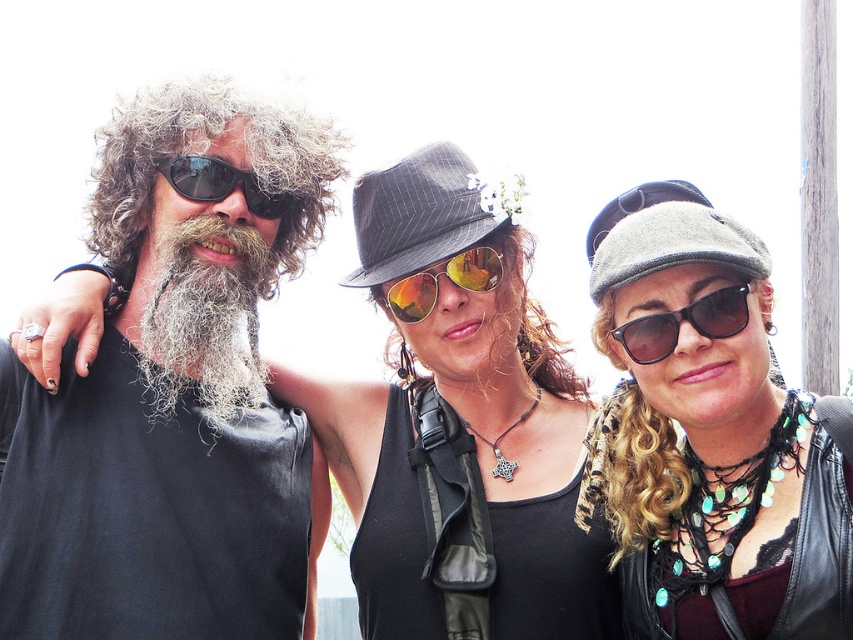
Question: Where is matte black tank top at left located in relation to leather jacket at center in the image?

Choices:
 (A) left
 (B) right

Answer: (A)

Question: Estimate the real-world distances between objects in this image. Which object is closer to the matte black tank top at left?

Choices:
 (A) reflective gold sunglasses at center
 (B) black pinstripe fedora at center
 (C) gray fabric cap at center
 (D) black reflective sunglasses at left

Answer: (D)

Question: Can you confirm if white curly beard at left is thinner than gray felt cap at center?

Choices:
 (A) yes
 (B) no

Answer: (B)

Question: Can you confirm if black reflective sunglasses at left is thinner than gray felt cap at center?

Choices:
 (A) no
 (B) yes

Answer: (A)

Question: Estimate the real-world distances between objects in this image. Which object is closer to the gray fabric cap at center?

Choices:
 (A) leather jacket at center
 (B) reflective gold sunglasses at center
 (C) black pinstripe fedora at center
 (D) gray felt cap at center

Answer: (D)

Question: Which point appears closest to the camera in this image?

Choices:
 (A) (694, 211)
 (B) (485, 275)
 (C) (589, 240)

Answer: (A)